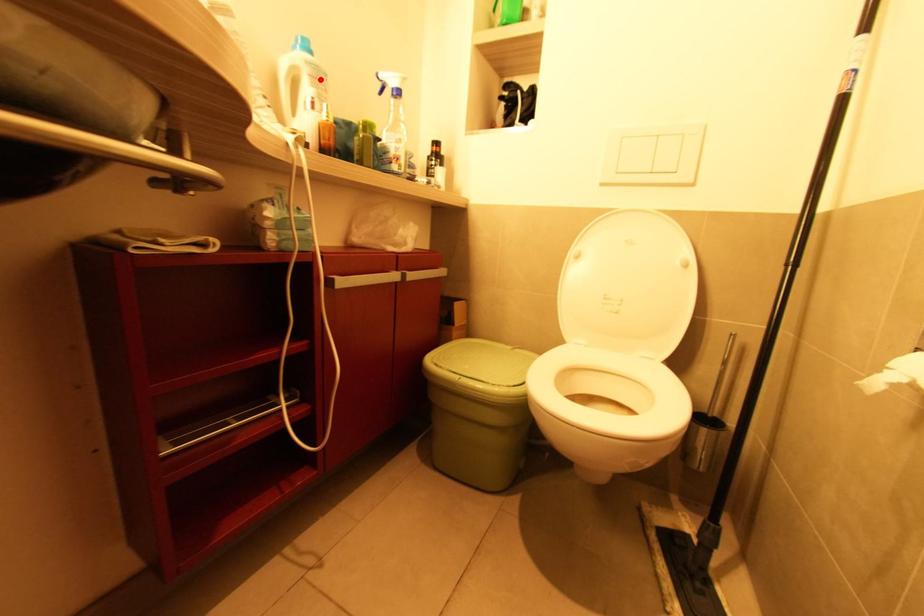
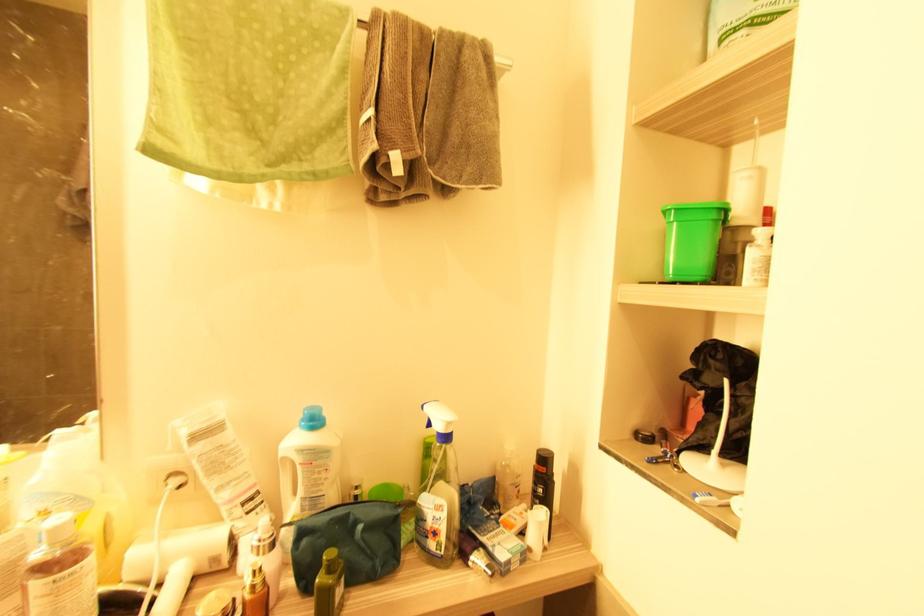
In the second image, find the point that corresponds to the highlighted location in the first image.

(315, 464)